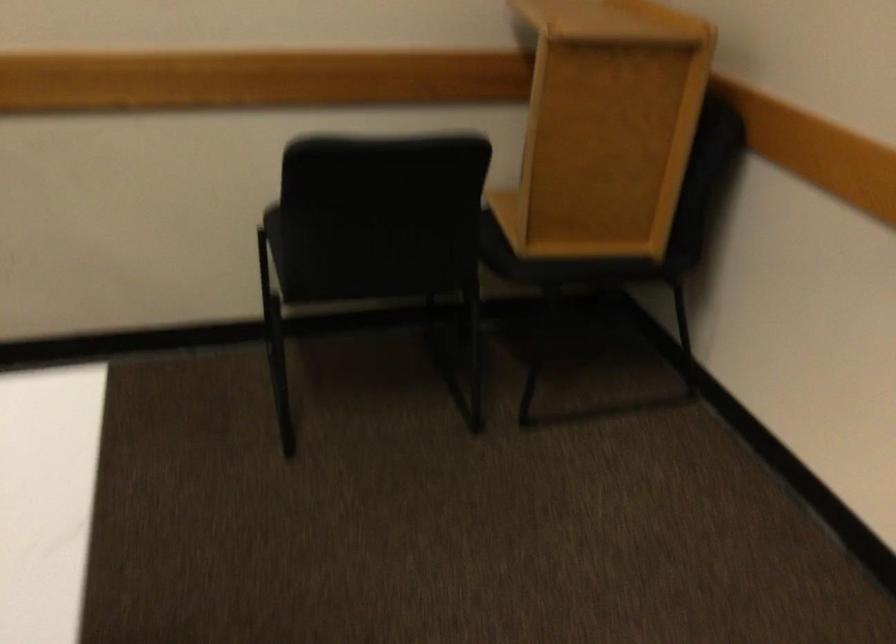
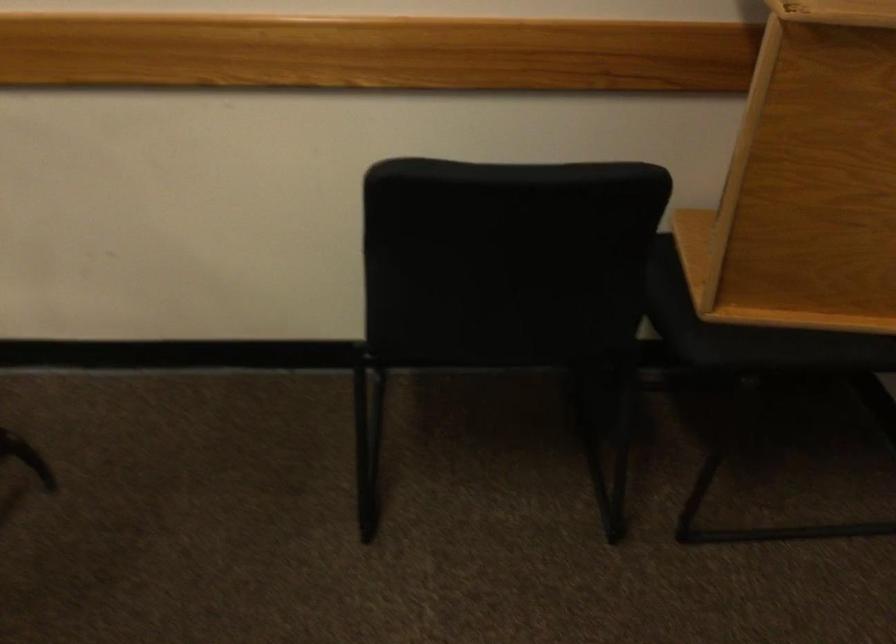
Question: The images are taken continuously from a first-person perspective. In which direction are you moving?

Choices:
 (A) Left
 (B) Right
 (C) Forward
 (D) Backward

Answer: (C)